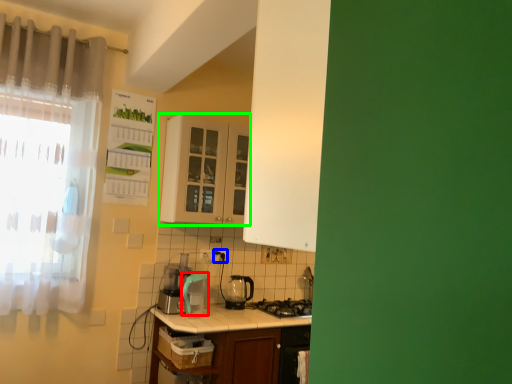
Question: Which object is the closest to the appliance (highlighted by a red box)? Choose among these: electric outlet (highlighted by a blue box) or cabinetry (highlighted by a green box).

Choices:
 (A) electric outlet
 (B) cabinetry

Answer: (A)